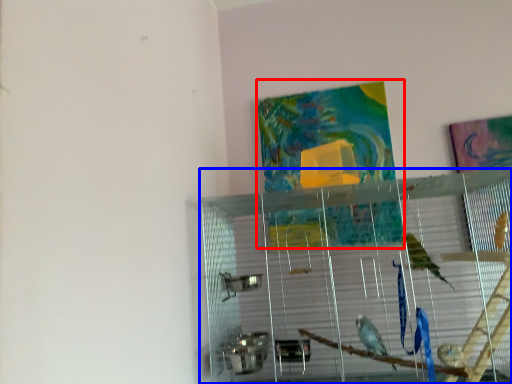
Question: Among these objects, which one is farthest to the camera, tapestry (highlighted by a red box) or glass box (highlighted by a blue box)?

Choices:
 (A) tapestry
 (B) glass box

Answer: (A)